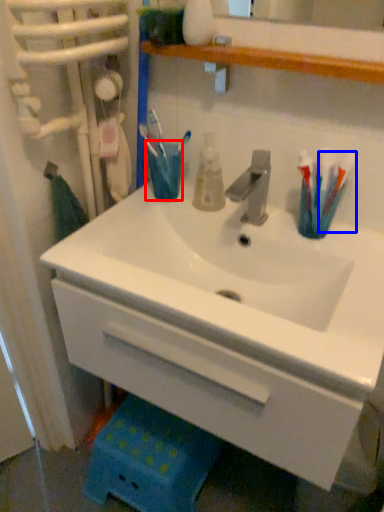
Question: Which of the following is the farthest to the observer, turquoise (highlighted by a red box) or toothbrush (highlighted by a blue box)?

Choices:
 (A) turquoise
 (B) toothbrush

Answer: (A)